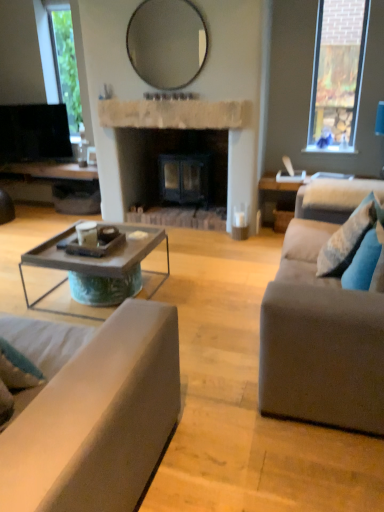
You are a GUI agent. You are given a task and a screenshot of the screen. Output one action in this format:
    pyautogui.click(x=<x>, y=<y>)
    Task: Click on the vacant area situated to the left side of gray fabric couch at right, which is the 1th studio couch in right-to-left order
    The height and width of the screenshot is (512, 384).
    Given the screenshot: What is the action you would take?
    pyautogui.click(x=213, y=320)